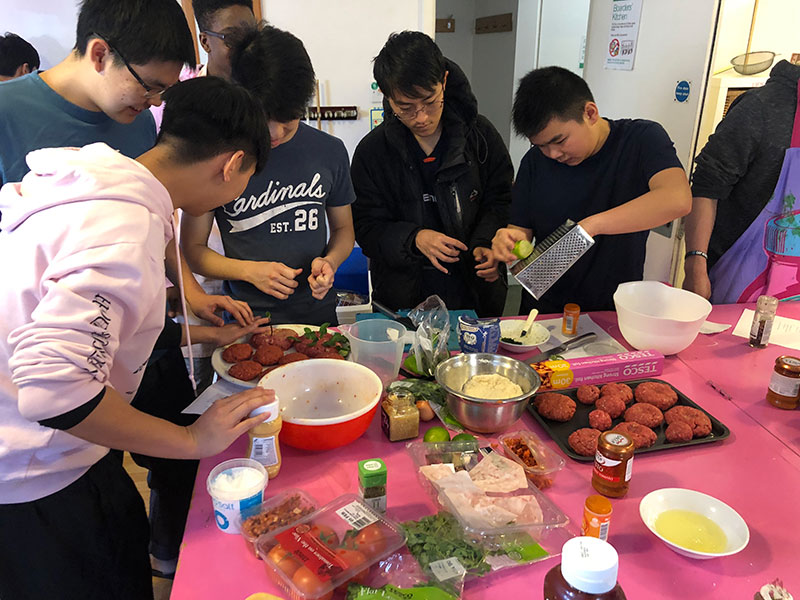
Identify the location of bowl of mayonaise. The height and width of the screenshot is (600, 800). (494, 390).